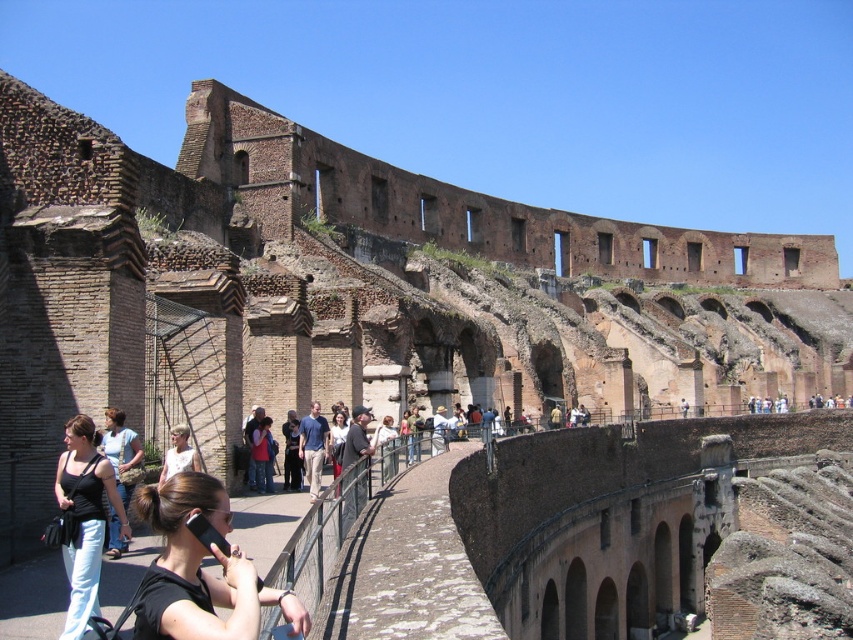
Can you confirm if black denim jeans at lower left is positioned below light brown leather jacket at lower left?

No.

Is the position of black denim jeans at lower left more distant than that of light brown leather jacket at lower left?

No, black denim jeans at lower left is in front of light brown leather jacket at lower left.

What do you see at coordinates (84, 518) in the screenshot?
I see `black denim jeans at lower left` at bounding box center [84, 518].

This screenshot has width=853, height=640. I want to click on black denim jeans at lower left, so click(84, 518).

Is point (128, 488) positioned after point (380, 476)?

No.

Where is `light brown leather jacket at lower left`? The height and width of the screenshot is (640, 853). light brown leather jacket at lower left is located at coordinates (120, 451).

Which is in front, point (112, 556) or point (381, 420)?

Point (112, 556)

I want to click on light brown leather jacket at lower left, so pyautogui.click(x=120, y=451).

Consider the image. Is black matte phone at center bigger than light brown leather jacket at lower left?

Yes.

Does black matte phone at center have a lesser height compared to light brown leather jacket at lower left?

No.

Describe the element at coordinates (200, 570) in the screenshot. Image resolution: width=853 pixels, height=640 pixels. I see `black matte phone at center` at that location.

Image resolution: width=853 pixels, height=640 pixels. I want to click on black matte phone at center, so coord(200,570).